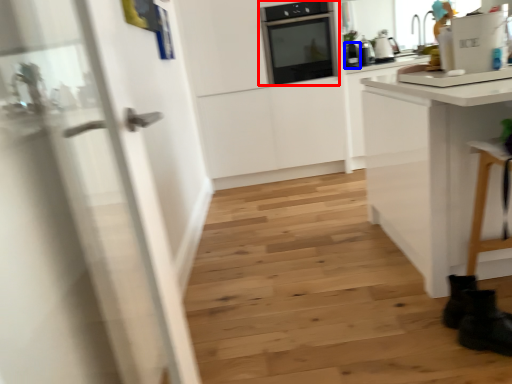
Question: Which object appears farthest to the camera in this image, home appliance (highlighted by a red box) or kitchen appliance (highlighted by a blue box)?

Choices:
 (A) home appliance
 (B) kitchen appliance

Answer: (B)